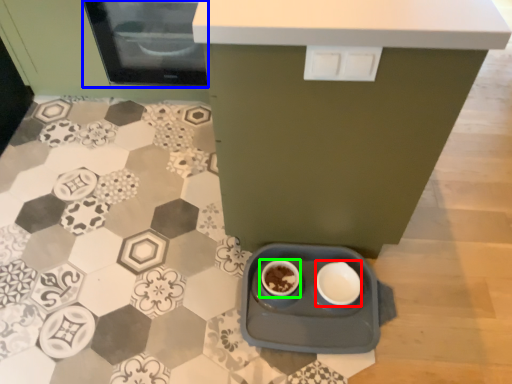
Question: Which object is positioned farthest from bowl (highlighted by a red box)? Select from home appliance (highlighted by a blue box) and coffee cup (highlighted by a green box).

Choices:
 (A) home appliance
 (B) coffee cup

Answer: (A)